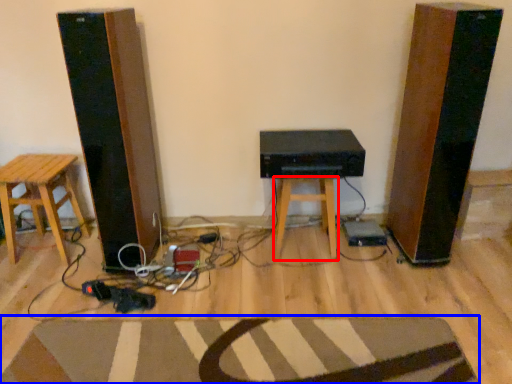
Question: Which object is further to the camera taking this photo, stool (highlighted by a red box) or doormat (highlighted by a blue box)?

Choices:
 (A) stool
 (B) doormat

Answer: (A)